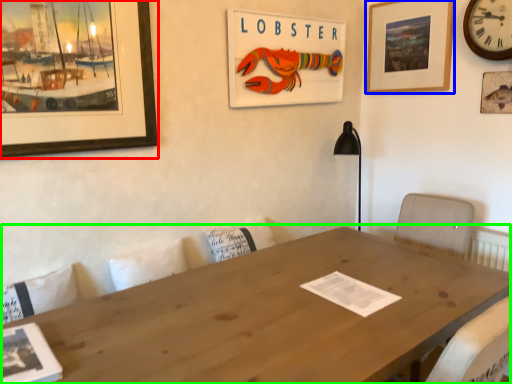
Question: Which is farther away from picture frame (highlighted by a red box)? picture frame (highlighted by a blue box) or table (highlighted by a green box)?

Choices:
 (A) picture frame
 (B) table

Answer: (A)